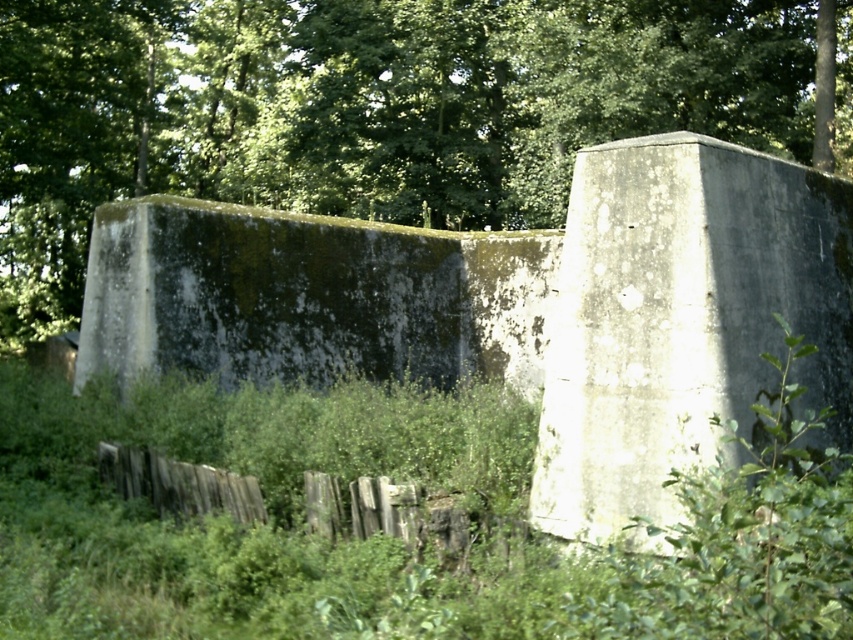
Question: Does green leafy tree at upper center have a greater width compared to weathered wood fence at lower center?

Choices:
 (A) no
 (B) yes

Answer: (B)

Question: Is green mossy concrete wall at center thinner than weathered wood fence at lower center?

Choices:
 (A) yes
 (B) no

Answer: (A)

Question: Among these points, which one is farthest from the camera?

Choices:
 (A) (677, 10)
 (B) (173, 472)
 (C) (730, 156)

Answer: (A)

Question: Which point is closer to the camera taking this photo?

Choices:
 (A) (360, 109)
 (B) (624, 512)

Answer: (B)

Question: Can you confirm if gray concrete wall at center is positioned to the left of green mossy concrete wall at center?

Choices:
 (A) no
 (B) yes

Answer: (A)

Question: Which object is farther from the camera taking this photo?

Choices:
 (A) green leafy tree at upper center
 (B) green mossy concrete wall at center
 (C) weathered wood fence at lower center

Answer: (A)